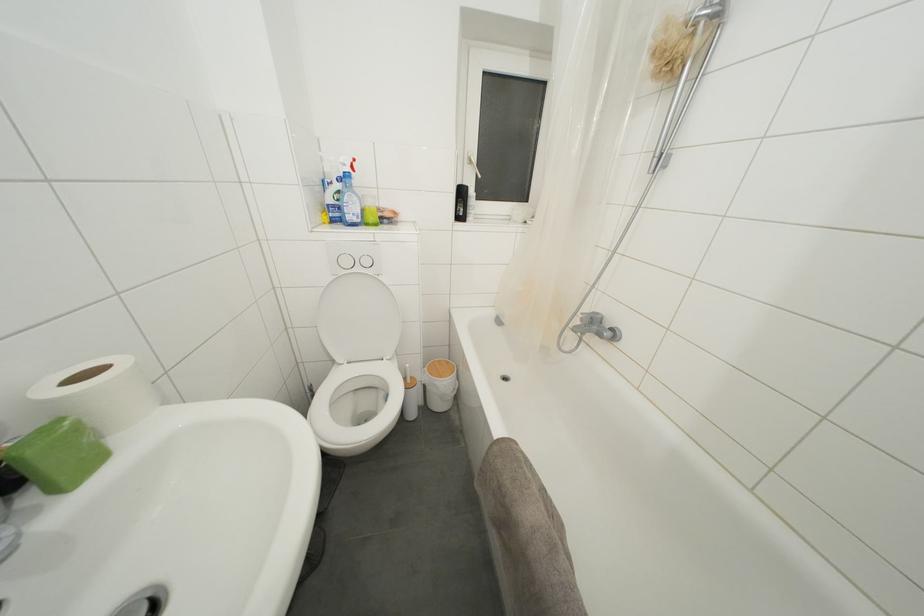
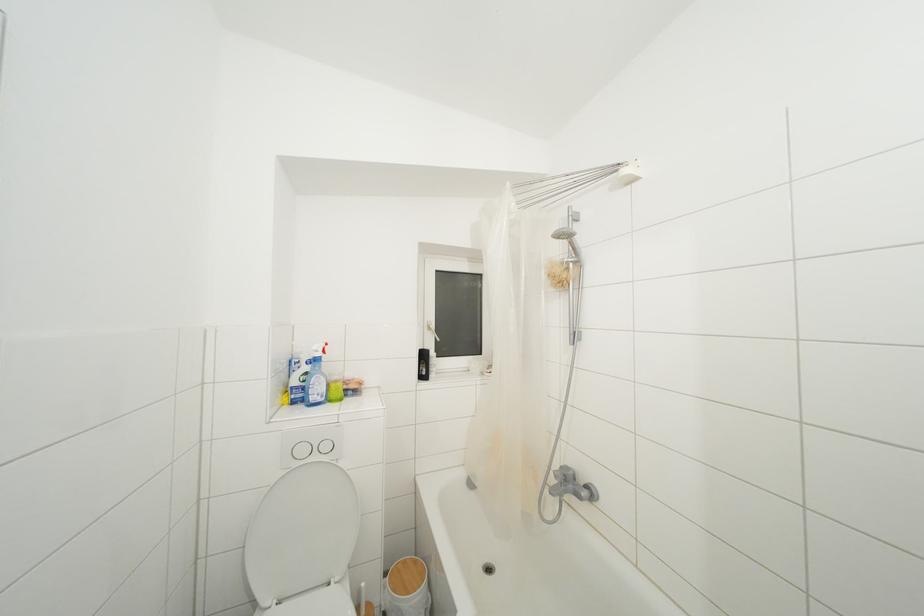
Where in the second image is the point corresponding to (x=466, y=198) from the first image?

(428, 361)